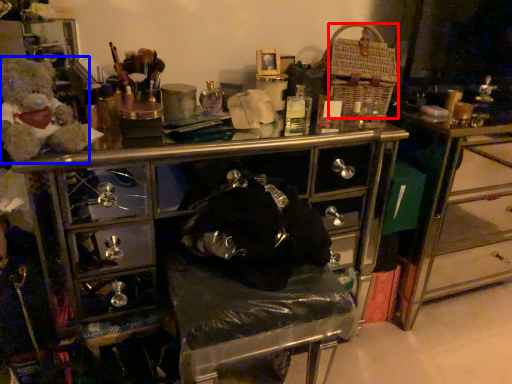
Question: Which object is closer to the camera taking this photo, crate (highlighted by a red box) or teddy (highlighted by a blue box)?

Choices:
 (A) crate
 (B) teddy

Answer: (B)